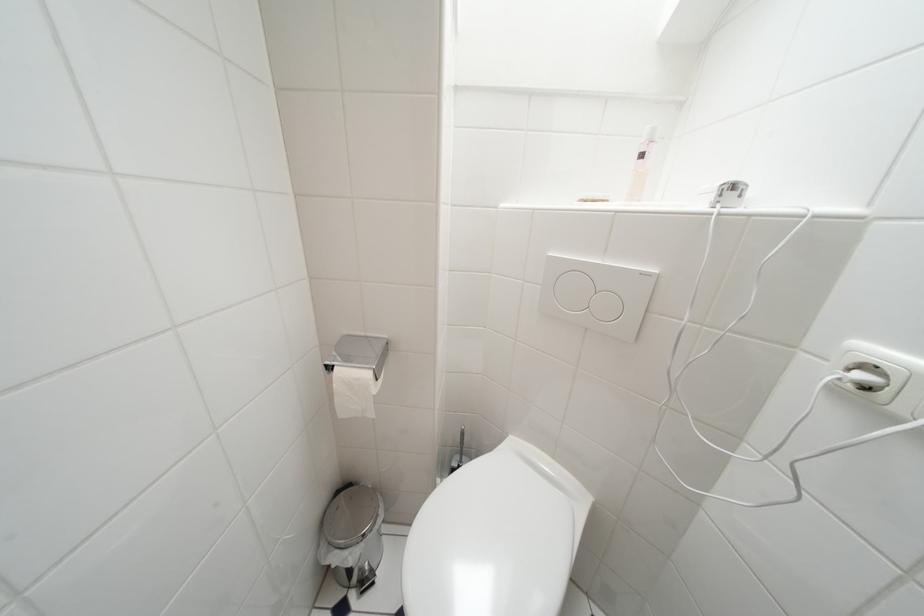
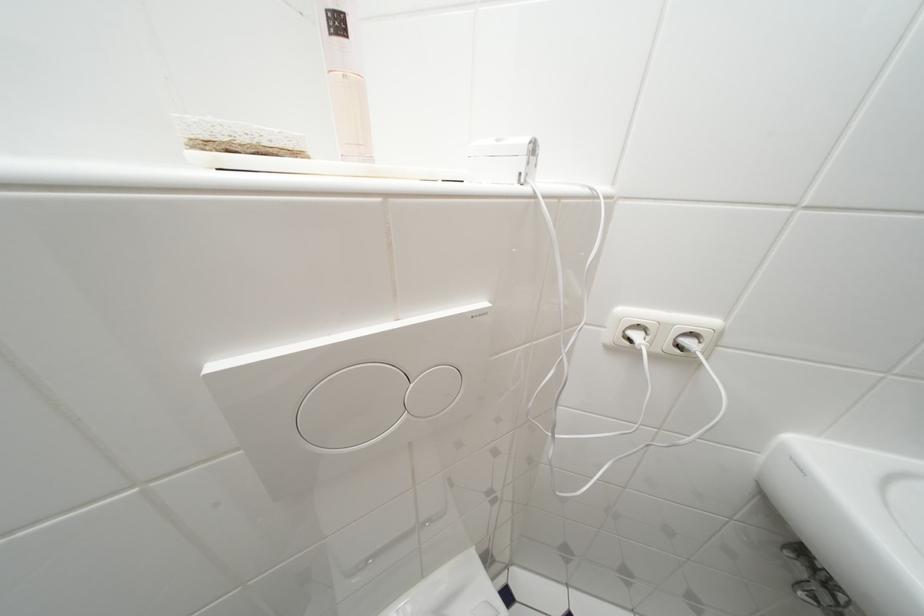
The point at (x=649, y=160) is marked in the first image. Where is the corresponding point in the second image?

(345, 26)